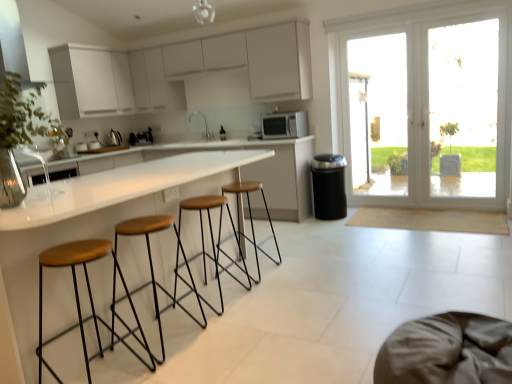
What do you see at coordinates (447, 351) in the screenshot? The height and width of the screenshot is (384, 512). I see `brown fabric swivel chair at lower right` at bounding box center [447, 351].

This screenshot has width=512, height=384. I want to click on matte white cabinets at upper left, acting as the 1th cabinetry starting from the left, so click(x=91, y=82).

Find the location of `brown leather stool at center, arranged as the fourth stool when viewed from the front`. brown leather stool at center, arranged as the fourth stool when viewed from the front is located at coordinates (251, 216).

What do you see at coordinates (285, 125) in the screenshot?
I see `white matte microwave at center, which is counted as the 1th appliance, starting from the front` at bounding box center [285, 125].

Image resolution: width=512 pixels, height=384 pixels. What are the coordinates of `brown fabric swivel chair at lower right` in the screenshot? It's located at (447, 351).

Is white glossy sink at center facing towards white matte microwave at center, the 2th appliance from the left?

No, white glossy sink at center does not turn towards white matte microwave at center, the 2th appliance from the left.

Is white glossy sink at center smaller than white matte microwave at center, placed as the first appliance when sorted from right to left?

Yes.

Does white glossy sink at center have a greater width compared to white matte microwave at center, which is counted as the 1th appliance, starting from the front?

No.

From the image's perspective, is metallic silver vent at upper left positioned above or below brown fabric swivel chair at lower right?

Clearly, from the image's perspective, metallic silver vent at upper left is above brown fabric swivel chair at lower right.

From a real-world perspective, is metallic silver vent at upper left positioned above or below brown fabric swivel chair at lower right?

metallic silver vent at upper left is above brown fabric swivel chair at lower right.

Which object is positioned more to the right, metallic silver vent at upper left or brown fabric swivel chair at lower right?

brown fabric swivel chair at lower right is more to the right.

Is metallic silver vent at upper left facing towards brown fabric swivel chair at lower right?

Yes, metallic silver vent at upper left is facing brown fabric swivel chair at lower right.

From their relative heights in the image, would you say brown leather stool at center, arranged as the fourth stool when viewed from the front, is taller or shorter than brown leather stool at lower left, the 4th stool positioned from the back?

In the image, brown leather stool at center, arranged as the fourth stool when viewed from the front, appears to be shorter than brown leather stool at lower left, the 4th stool positioned from the back.

Is brown leather stool at center, the 1th stool when ordered from back to front, not inside brown leather stool at lower left, the first stool when ordered from front to back?

Yes.

Is brown leather stool at center, the 1th stool when ordered from back to front, turned away from brown leather stool at lower left, the 4th stool positioned from the back?

No, brown leather stool at lower left, the 4th stool positioned from the back, is not at the back of brown leather stool at center, the 1th stool when ordered from back to front.

Considering the sizes of brown leather stool at center, the 1th stool when ordered from back to front, and brown leather stool at lower left, the 4th stool positioned from the back, in the image, is brown leather stool at center, the 1th stool when ordered from back to front, bigger or smaller than brown leather stool at lower left, the 4th stool positioned from the back,?

Clearly, brown leather stool at center, the 1th stool when ordered from back to front, is larger in size than brown leather stool at lower left, the 4th stool positioned from the back.

From a real-world perspective, is white matte cabinets at upper center, placed as the 2th cabinetry when sorted from left to right, on brown leather stool at lower left, the first stool when ordered from front to back?

Yes, from a real-world perspective, white matte cabinets at upper center, placed as the 2th cabinetry when sorted from left to right, is over brown leather stool at lower left, the first stool when ordered from front to back

Which point is more forward, (213, 61) or (45, 259)?

The point (45, 259) is in front.

In the scene shown: Is white matte cabinets at upper center, placed as the first cabinetry when sorted from right to left, positioned behind brown leather stool at lower left, the 4th stool positioned from the back?

Yes, white matte cabinets at upper center, placed as the first cabinetry when sorted from right to left, is further from the camera.

Is the depth of white matte cabinets at upper center, placed as the first cabinetry when sorted from right to left, less than that of brown leather stool at center, acting as the third stool starting from the front?

That is False.

Considering the sizes of objects white matte cabinets at upper center, placed as the first cabinetry when sorted from right to left, and brown leather stool at center, which appears as the second stool when viewed from the back, in the image provided, who is taller, white matte cabinets at upper center, placed as the first cabinetry when sorted from right to left, or brown leather stool at center, which appears as the second stool when viewed from the back,?

With more height is white matte cabinets at upper center, placed as the first cabinetry when sorted from right to left.

Are white matte cabinets at upper center, placed as the 2th cabinetry when sorted from left to right, and brown leather stool at center, which appears as the second stool when viewed from the back, far apart?

Yes, white matte cabinets at upper center, placed as the 2th cabinetry when sorted from left to right, and brown leather stool at center, which appears as the second stool when viewed from the back, are quite far apart.

Based on their sizes in the image, would you say white matte cabinets at upper center, placed as the 2th cabinetry when sorted from left to right, is bigger or smaller than brown leather stool at center, acting as the third stool starting from the front?

Considering their sizes, white matte cabinets at upper center, placed as the 2th cabinetry when sorted from left to right, takes up more space than brown leather stool at center, acting as the third stool starting from the front.

This screenshot has height=384, width=512. In order to click on screen door behind the transparent glass door at right in this screenshot , I will do `click(376, 113)`.

From the image's perspective, which object appears higher, transparent glass door at right or transparent glass door at right?

transparent glass door at right appears higher in the image.

Where is `window screen above the brown leather stool at lower left, the first stool when ordered from front to back (from the image's perspective)`? The height and width of the screenshot is (384, 512). window screen above the brown leather stool at lower left, the first stool when ordered from front to back (from the image's perspective) is located at coordinates (463, 107).

Between brown leather stool at lower left, the 4th stool positioned from the back, and transparent glass door at right, which one has more height?

transparent glass door at right.

Is brown leather stool at lower left, the first stool when ordered from front to back, not within transparent glass door at right?

That's correct, brown leather stool at lower left, the first stool when ordered from front to back, is outside of transparent glass door at right.

Find the location of `appliance that is the 1st one when counting downward from the white glossy sink at center (from the image's perspective)`. appliance that is the 1st one when counting downward from the white glossy sink at center (from the image's perspective) is located at coordinates (285, 125).

Identify the location of window above the brown fabric swivel chair at lower right (from a real-world perspective). (13, 45).

Considering their positions, is white matte cabinets at upper center, placed as the 2th cabinetry when sorted from left to right, positioned closer to transparent glass door at right than wooden seat stool at center, arranged as the 3th stool when viewed from the back?

white matte cabinets at upper center, placed as the 2th cabinetry when sorted from left to right, is closer to transparent glass door at right.

Which object lies nearer to the anchor point brown leather stool at center, the 1th stool when ordered from back to front, brown leather stools at center or white glossy sink at center?

The object closer to brown leather stool at center, the 1th stool when ordered from back to front, is brown leather stools at center.

Based on their spatial positions, is transparent glass door at right or white glossy sink at center closer to brown leather stool at lower left, the 4th stool positioned from the back?

Based on the image, white glossy sink at center appears to be nearer to brown leather stool at lower left, the 4th stool positioned from the back.

From the image, which object appears to be farther from white matte cabinets at upper center, placed as the first cabinetry when sorted from right to left, transparent glass door at right or metallic silver kettle at center, arranged as the 2th appliance when viewed from the right?

Among the two, transparent glass door at right is located further to white matte cabinets at upper center, placed as the first cabinetry when sorted from right to left.

Considering their positions, is brown leather stools at center positioned further to transparent glass door at right than satin silver coffee machine at center?

Among the two, brown leather stools at center is located further to transparent glass door at right.

Considering their positions, is brown leather stools at center positioned closer to white glossy sink at center than satin silver coffee machine at center?

satin silver coffee machine at center is positioned closer to the anchor white glossy sink at center.

When comparing their distances from transparent glass door at right, does brown leather stools at center or wooden seat stool at center, the second stool from the front, seem closer?

Based on the image, brown leather stools at center appears to be nearer to transparent glass door at right.

Estimate the real-world distances between objects in this image. Which object is further from brown fabric swivel chair at lower right, transparent glass door at right or white glossy sink at center?

white glossy sink at center is positioned further to the anchor brown fabric swivel chair at lower right.

The height and width of the screenshot is (384, 512). In order to click on appliance between brown fabric swivel chair at lower right and metallic silver kettle at center, arranged as the 2th appliance when viewed from the right, along the z-axis in this screenshot , I will do `click(285, 125)`.

Identify the location of sink between wooden seat stool at center, arranged as the 3th stool when viewed from the back, and metallic silver kettle at center, positioned as the first appliance in left-to-right order, along the z-axis. Image resolution: width=512 pixels, height=384 pixels. (204, 124).

Locate an element on the screen. Image resolution: width=512 pixels, height=384 pixels. appliance between matte white cabinets at upper left, the 2th cabinetry from the right, and satin silver coffee machine at center in the front-back direction is located at coordinates (115, 138).

The width and height of the screenshot is (512, 384). Identify the location of round table between brown fabric swivel chair at lower right and white glossy sink at center from front to back. 97,220.